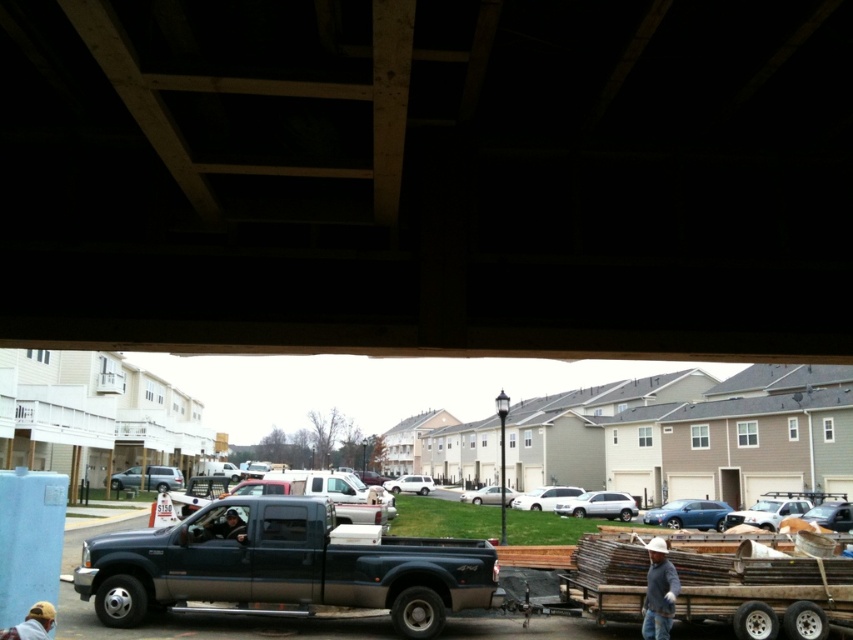
Based on the photo, does wooden beams at upper center come behind white hard hat at lower right?

No, wooden beams at upper center is closer to the viewer.

Can you confirm if wooden beams at upper center is bigger than white hard hat at lower right?

Yes.

The image size is (853, 640). What are the coordinates of `wooden beams at upper center` in the screenshot? It's located at (428, 176).

This screenshot has height=640, width=853. I want to click on wooden beams at upper center, so click(x=428, y=176).

Looking at this image, how much distance is there between wooden beams at upper center and matte dark green truck at center?

wooden beams at upper center is 9.82 meters away from matte dark green truck at center.

In order to click on wooden beams at upper center in this screenshot , I will do `click(428, 176)`.

Image resolution: width=853 pixels, height=640 pixels. What do you see at coordinates (428, 176) in the screenshot?
I see `wooden beams at upper center` at bounding box center [428, 176].

Find the location of `wooden beams at upper center`. wooden beams at upper center is located at coordinates (428, 176).

Does matte dark green truck at center have a lesser width compared to white hard hat at lower right?

Yes, matte dark green truck at center is thinner than white hard hat at lower right.

Is matte dark green truck at center wider than white hard hat at lower right?

Incorrect, matte dark green truck at center's width does not surpass white hard hat at lower right's.

Does point (120, 566) lie in front of point (656, 580)?

No, it is not.

Identify the location of matte dark green truck at center. (283, 566).